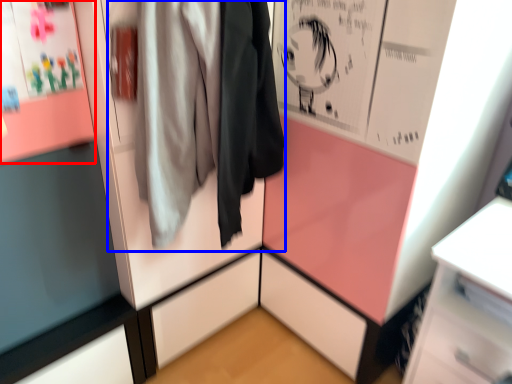
Question: Which object is further to the camera taking this photo, poster page (highlighted by a red box) or jacket (highlighted by a blue box)?

Choices:
 (A) poster page
 (B) jacket

Answer: (A)